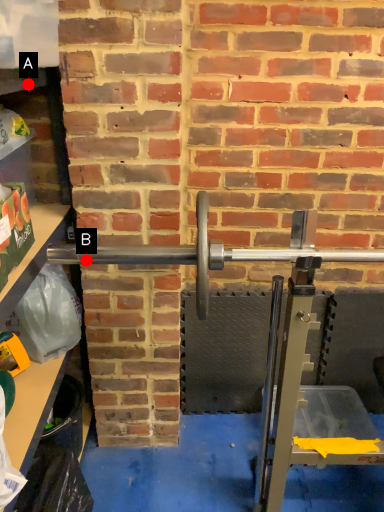
Question: Two points are circled on the image, labeled by A and B beside each circle. Among these points, which one is nearest to the camera?

Choices:
 (A) A is closer
 (B) B is closer

Answer: (B)